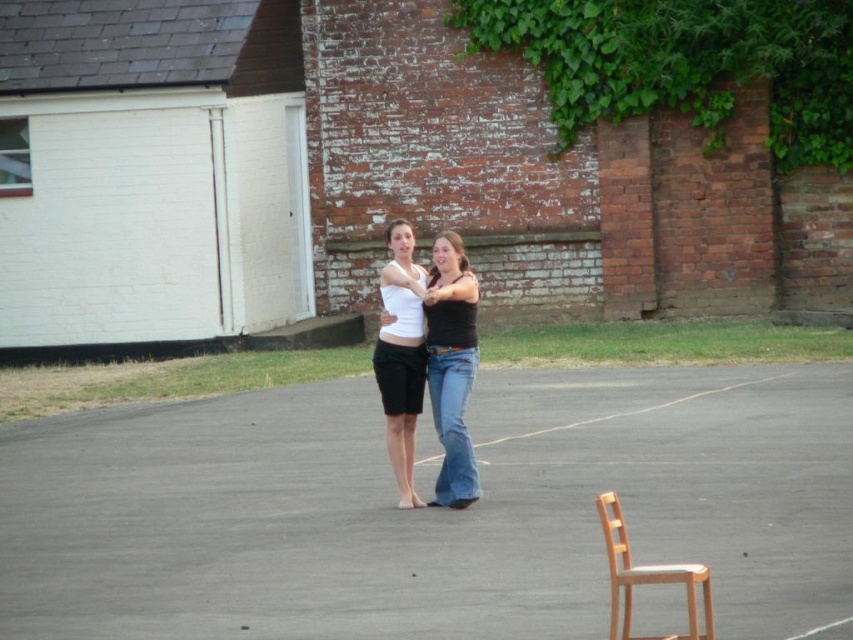
You are a photographer setting up a shoot in this scene. You want to position a new tripod in front of the matte black shorts at center without blocking the light brown wooden chair at lower right. Is this possible?

The light brown wooden chair at lower right is behind the matte black shorts at center, so placing the tripod in front of the matte black shorts at center would not block the chair since it is already behind the shorts.

You are a photographer setting up for a photo shoot. You need to ensure that the two people wearing the matte black shorts at center and white matte shorts at center are positioned such that there is at least 8 inches of space between them for optimal lighting. Based on the current setup, is this requirement met?

The distance between the matte black shorts at center and white matte shorts at center is 7.52 inches, which is less than the required 8 inches. Therefore, the requirement is not met and they need to move slightly farther apart.

You are a photographer setting up a shoot in this scene. You need to position a small prop on the ground between the matte black shorts at center and the light brown wooden chair at lower right. Based on their positions, will the prop be placed closer to the shorts or the chair?

The prop will be placed closer to the light brown wooden chair at lower right because the matte black shorts at center is above it, meaning the shorts are higher up and the chair is lower down, so the space between them slopes downward towards the chair.